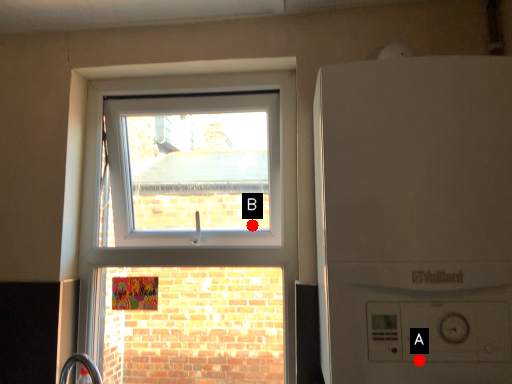
Question: Two points are circled on the image, labeled by A and B beside each circle. Which point is closer to the camera taking this photo?

Choices:
 (A) A is closer
 (B) B is closer

Answer: (A)